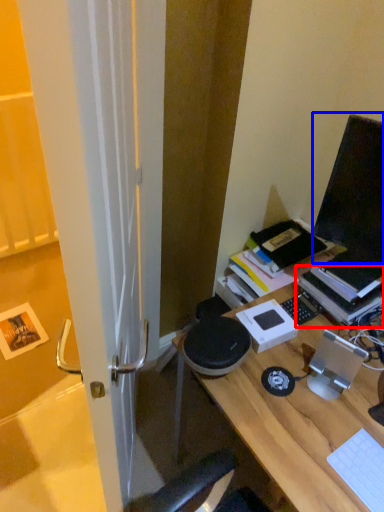
Question: Which object appears farthest to the camera in this image, paperback book (highlighted by a red box) or computer monitor (highlighted by a blue box)?

Choices:
 (A) paperback book
 (B) computer monitor

Answer: (A)